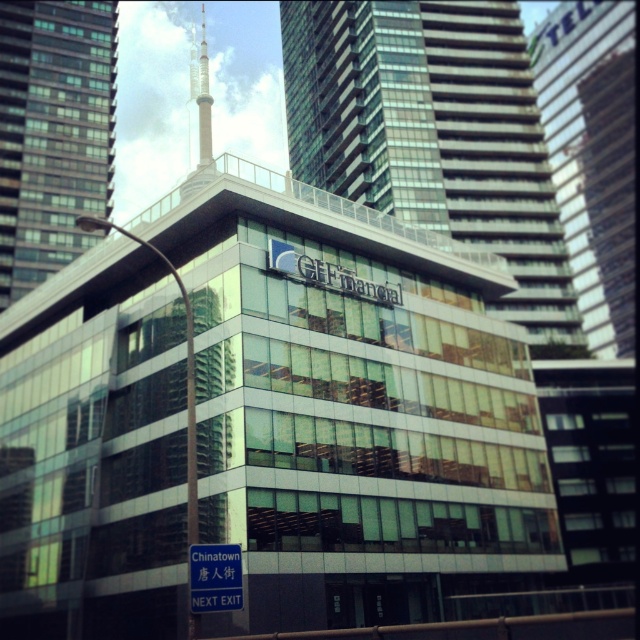
Question: Which object appears farthest from the camera in this image?

Choices:
 (A) glassy skyscraper at center
 (B) blue plastic street sign at lower center
 (C) glassy skyscraper at upper right
 (D) glassy reflective building at center

Answer: (C)

Question: Which of these objects is positioned closest to the glassy skyscraper at center?

Choices:
 (A) glassy reflective building at center
 (B) blue plastic street sign at lower center

Answer: (A)

Question: Is the position of glassy reflective building at center less distant than that of blue plastic street sign at lower center?

Choices:
 (A) yes
 (B) no

Answer: (B)

Question: Observing the image, what is the correct spatial positioning of glassy reflective building at center in reference to glassy skyscraper at center?

Choices:
 (A) right
 (B) left

Answer: (A)

Question: Observing the image, what is the correct spatial positioning of glassy skyscraper at center in reference to glassy skyscraper at upper right?

Choices:
 (A) below
 (B) above

Answer: (A)

Question: Which point is farther to the camera?

Choices:
 (A) glassy reflective building at center
 (B) glassy skyscraper at upper right
 (C) glassy skyscraper at center

Answer: (B)